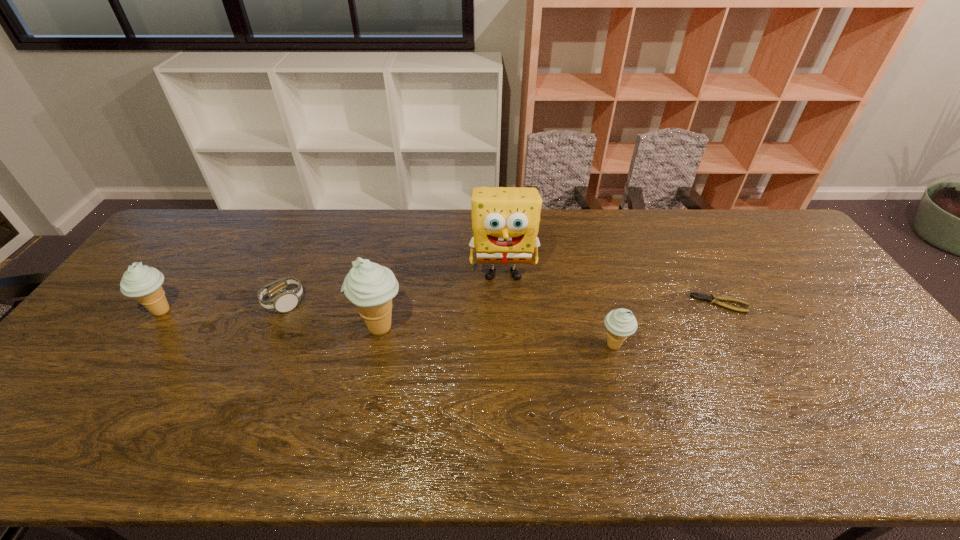
With all icecreams evenly spaced, where should an extra icecream be placed on the right to continue the pattern? Please point out a vacant space. Please provide its 2D coordinates. Your answer should be formatted as a tuple, i.e. [(x, y)], where the tuple contains the x and y coordinates of a point satisfying the conditions above.

[(867, 365)]